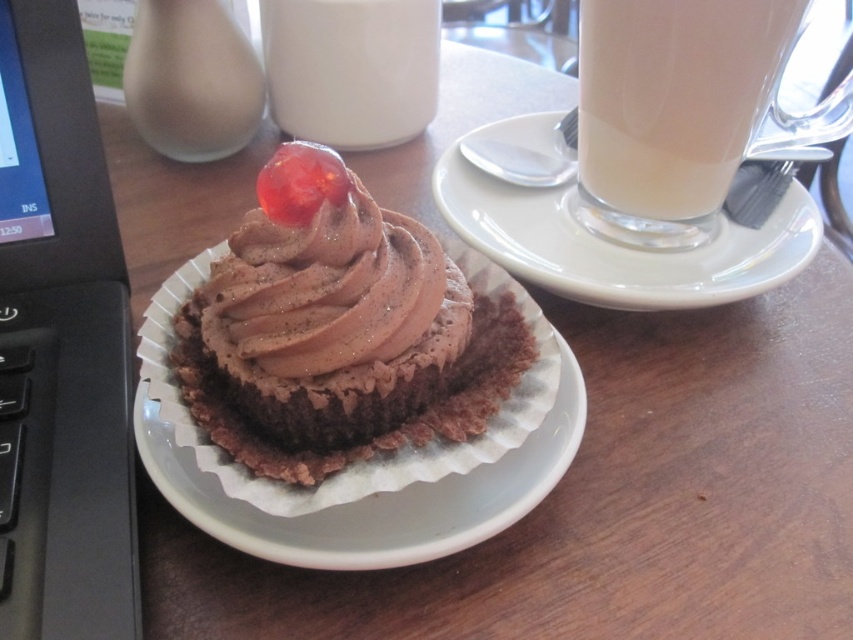
Question: Can you confirm if black plastic laptop at left is positioned below white paper plate at upper right?

Choices:
 (A) no
 (B) yes

Answer: (B)

Question: Which point appears farthest from the camera in this image?

Choices:
 (A) (120, 538)
 (B) (543, 400)

Answer: (B)

Question: Does white paper plate at center appear on the left side of white paper plate at upper right?

Choices:
 (A) yes
 (B) no

Answer: (A)

Question: Which object appears closest to the camera in this image?

Choices:
 (A) shiny red cherry at center
 (B) white paper plate at upper right
 (C) white paper plate at center

Answer: (C)

Question: Which of the following is the closest to the observer?

Choices:
 (A) black plastic laptop at left
 (B) white glossy milkshake at upper center
 (C) white paper plate at center

Answer: (A)

Question: Where is white frothy beverage at upper right located in relation to white glossy milkshake at upper center in the image?

Choices:
 (A) left
 (B) right

Answer: (B)